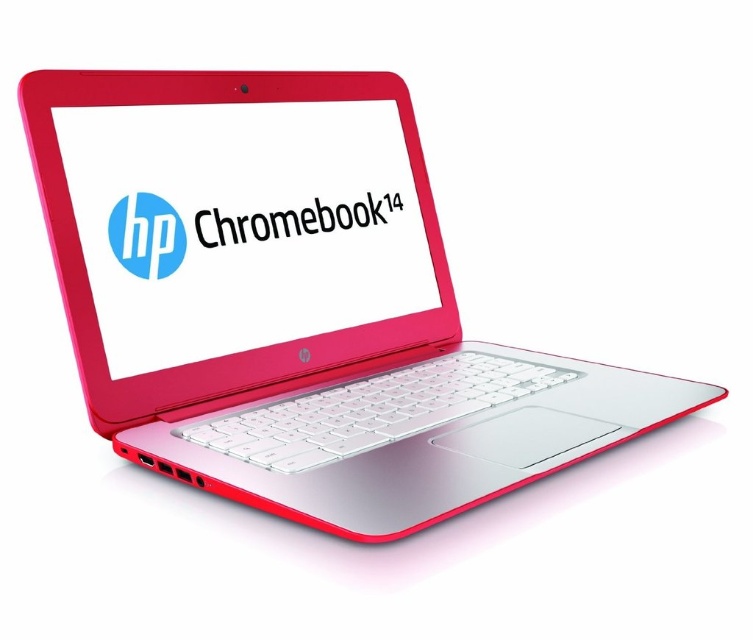
Question: Does matte plastic laptop at center have a smaller size compared to matte plastic logo at center?

Choices:
 (A) yes
 (B) no

Answer: (B)

Question: Which point is closer to the camera taking this photo?

Choices:
 (A) (145, 273)
 (B) (290, 234)
 (C) (354, 120)
 (D) (123, 257)

Answer: (D)

Question: Can you confirm if matte plastic laptop at center is positioned below matte plastic logo at center?

Choices:
 (A) yes
 (B) no

Answer: (A)

Question: Which point is closer to the camera?

Choices:
 (A) (428, 307)
 (B) (223, 225)
 (C) (139, 241)

Answer: (C)

Question: Can you confirm if matte plastic chromebook at center is positioned above matte plastic logo at center?

Choices:
 (A) yes
 (B) no

Answer: (A)

Question: Which of the following is the closest to the observer?

Choices:
 (A) matte plastic chromebook at center
 (B) matte plastic laptop at center

Answer: (B)